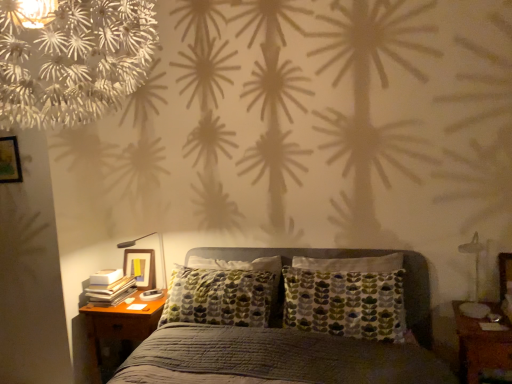
Identify the location of empty space that is ontop of brown wooden nightstand at lower right, the second nightstand when ordered from left to right. This screenshot has width=512, height=384. (484, 317).